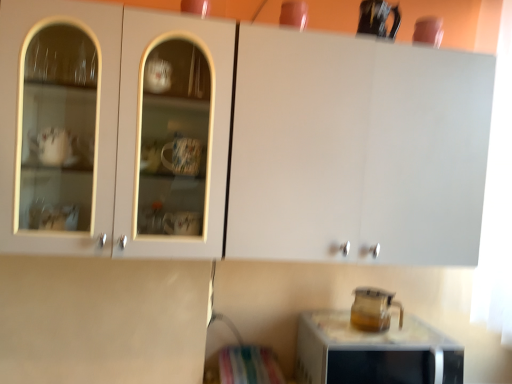
Identify the location of free location above transparent glass pitcher at lower right (from a real-world perspective). This screenshot has height=384, width=512. (370, 329).